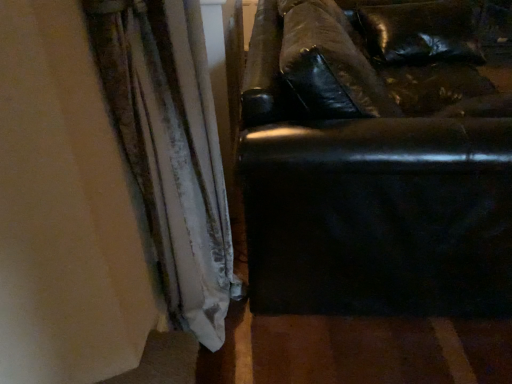
Question: From the image's perspective, is velvet-like white curtain at left positioned above or below black leather couch at right?

Choices:
 (A) below
 (B) above

Answer: (A)

Question: Is point (158, 152) positioned closer to the camera than point (269, 105)?

Choices:
 (A) closer
 (B) farther

Answer: (A)

Question: In the image, is velvet-like white curtain at left positioned in front of or behind black leather couch at right?

Choices:
 (A) behind
 (B) front

Answer: (B)

Question: From the image's perspective, relative to velvet-like white curtain at left, is black leather couch at right above or below?

Choices:
 (A) below
 (B) above

Answer: (B)

Question: In the image, is black leather couch at right positioned in front of or behind velvet-like white curtain at left?

Choices:
 (A) behind
 (B) front

Answer: (A)

Question: From a real-world perspective, is black leather couch at right positioned above or below velvet-like white curtain at left?

Choices:
 (A) below
 (B) above

Answer: (A)

Question: Looking at the image, does black leather couch at right seem bigger or smaller compared to velvet-like white curtain at left?

Choices:
 (A) big
 (B) small

Answer: (A)